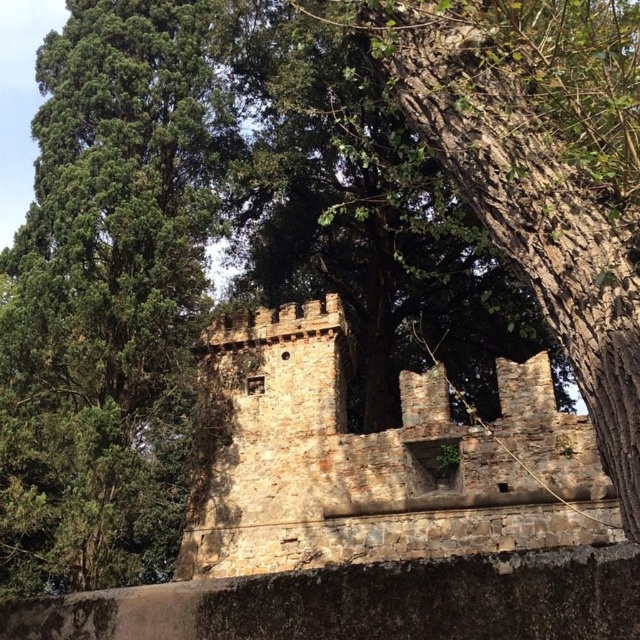
You are a hiker who wants to take a photo of both the green leafy tree at center and the brown stone castle at center. Which object should you focus on first if you want to ensure both are in the frame without moving the camera?

The green leafy tree at center has a lesser width compared to the brown stone castle at center, so you should focus on the brown stone castle at center first to ensure both fit in the frame.

You are a drone operator flying a drone over the stone structure. You notice two points marked in the image, point 1 at coordinates (180,275) and point 2 at coordinates (356,548). Which point is closer to your drone?

Point 1 at coordinates (180,275) is closer to the drone because it is further to the camera than point 2 at coordinates (356,548).